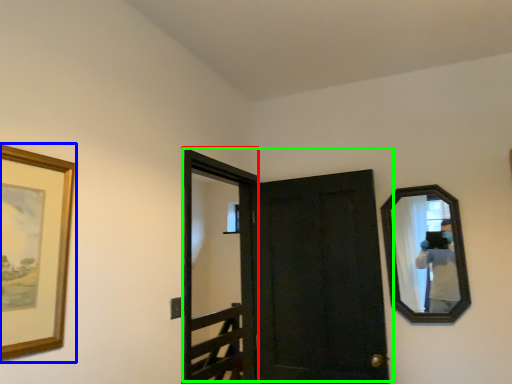
Question: Considering the real-world distances, which object is closest to screen door (highlighted by a red box)? picture frame (highlighted by a blue box) or door (highlighted by a green box).

Choices:
 (A) picture frame
 (B) door

Answer: (B)